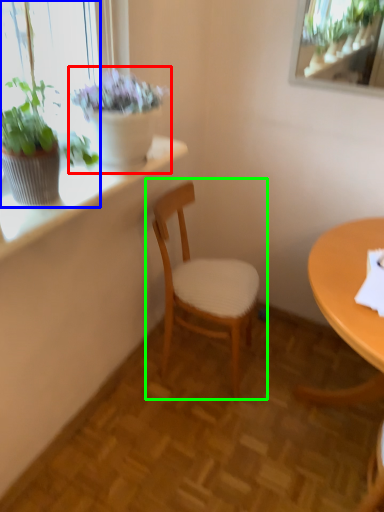
Question: Which object is positioned closest to houseplant (highlighted by a red box)? Select from houseplant (highlighted by a blue box) and chair (highlighted by a green box).

Choices:
 (A) houseplant
 (B) chair

Answer: (A)